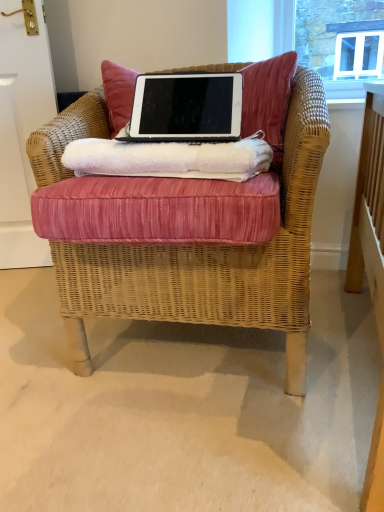
Question: From a real-world perspective, is pink fabric cushion at center positioned under velvet cushion at upper center based on gravity?

Choices:
 (A) yes
 (B) no

Answer: (A)

Question: Can you confirm if pink fabric cushion at center is positioned to the right of velvet cushion at upper center?

Choices:
 (A) yes
 (B) no

Answer: (B)

Question: From the image's perspective, is pink fabric cushion at center over velvet cushion at upper center?

Choices:
 (A) no
 (B) yes

Answer: (A)

Question: Considering the relative sizes of pink fabric cushion at center and velvet cushion at upper center in the image provided, is pink fabric cushion at center thinner than velvet cushion at upper center?

Choices:
 (A) no
 (B) yes

Answer: (A)

Question: Can you confirm if pink fabric cushion at center is taller than velvet cushion at upper center?

Choices:
 (A) no
 (B) yes

Answer: (A)

Question: Looking at the image, does velvet cushion at upper center seem bigger or smaller compared to pink fabric cushion at center?

Choices:
 (A) big
 (B) small

Answer: (B)

Question: Relative to pink fabric cushion at center, is velvet cushion at upper center in front or behind?

Choices:
 (A) front
 (B) behind

Answer: (B)

Question: Would you say velvet cushion at upper center is to the left or to the right of pink fabric cushion at center in the picture?

Choices:
 (A) right
 (B) left

Answer: (A)

Question: Choose the correct answer: Is velvet cushion at upper center inside pink fabric cushion at center or outside it?

Choices:
 (A) inside
 (B) outside

Answer: (B)

Question: Looking at the image, does white fluffy towel at center seem bigger or smaller compared to velvet cushion at upper center?

Choices:
 (A) small
 (B) big

Answer: (A)

Question: From a real-world perspective, is white fluffy towel at center above or below velvet cushion at upper center?

Choices:
 (A) below
 (B) above

Answer: (A)

Question: From the image's perspective, is white fluffy towel at center located above or below velvet cushion at upper center?

Choices:
 (A) below
 (B) above

Answer: (A)

Question: Does point (82, 168) appear closer or farther from the camera than point (119, 96)?

Choices:
 (A) farther
 (B) closer

Answer: (B)

Question: Is black matte laptop at center inside the boundaries of velvet cushion at upper center, or outside?

Choices:
 (A) inside
 (B) outside

Answer: (B)

Question: Relative to velvet cushion at upper center, is black matte laptop at center in front or behind?

Choices:
 (A) front
 (B) behind

Answer: (A)